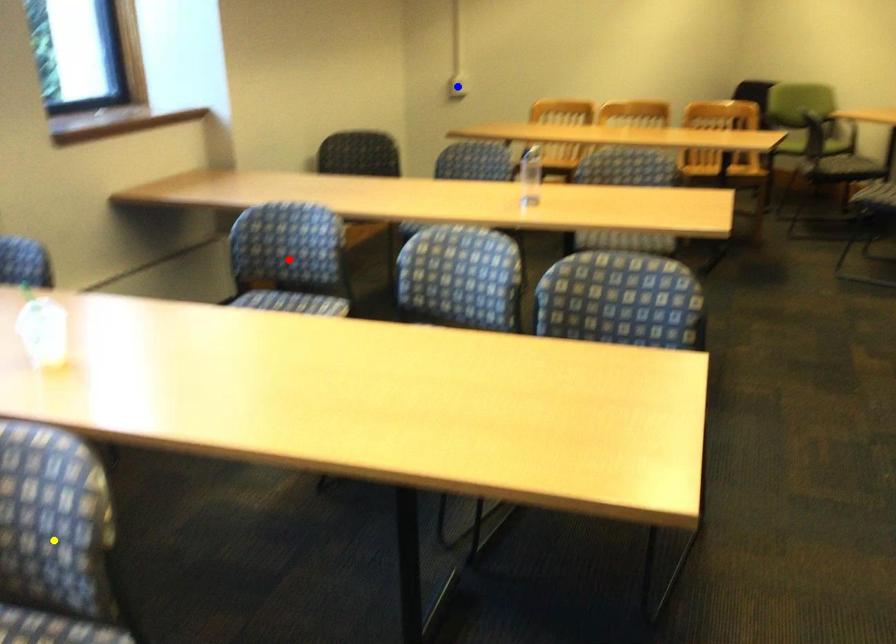
Order these from nearest to farthest:
1. yellow point
2. red point
3. blue point

yellow point < red point < blue point